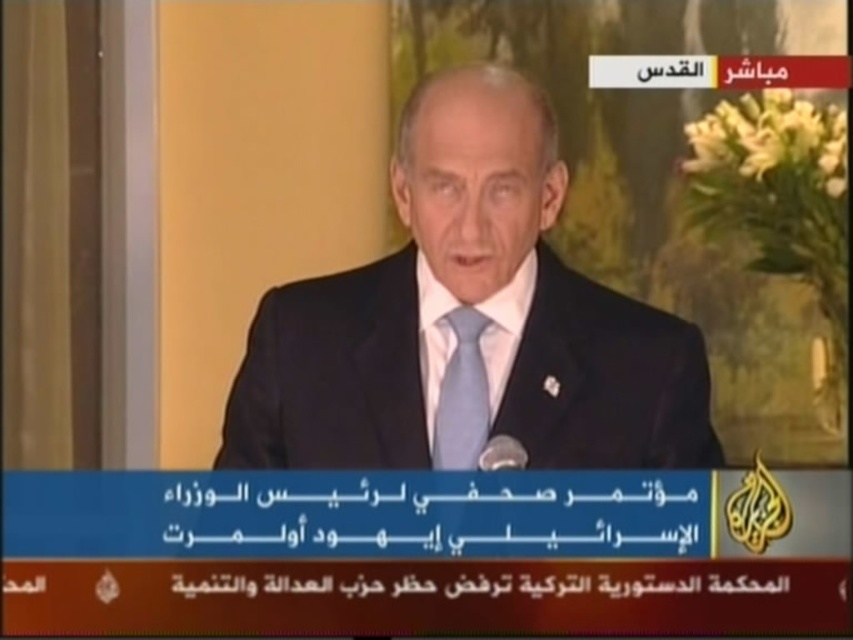
You are designing a costume for a play and need to ensure that the dark blue suit at center and the light blue silk tie at center will fit together properly. Given their sizes, which item will require more fabric to create?

The dark blue suit at center requires more fabric because its width is larger than the light blue silk tie at center.

You are a camera operator adjusting the focus on a zoom lens. You notice two points in the scene that need to be in focus simultaneously. The points are labeled as point (502,173) and point (480,406). Given their positions, which point should you prioritize focusing on first to ensure both remain sharp?

Point (502,173) should be prioritized because it is closer to the viewer than point (480,406). By focusing on the closer point, the depth of field will naturally extend to the farther point, keeping both in focus.